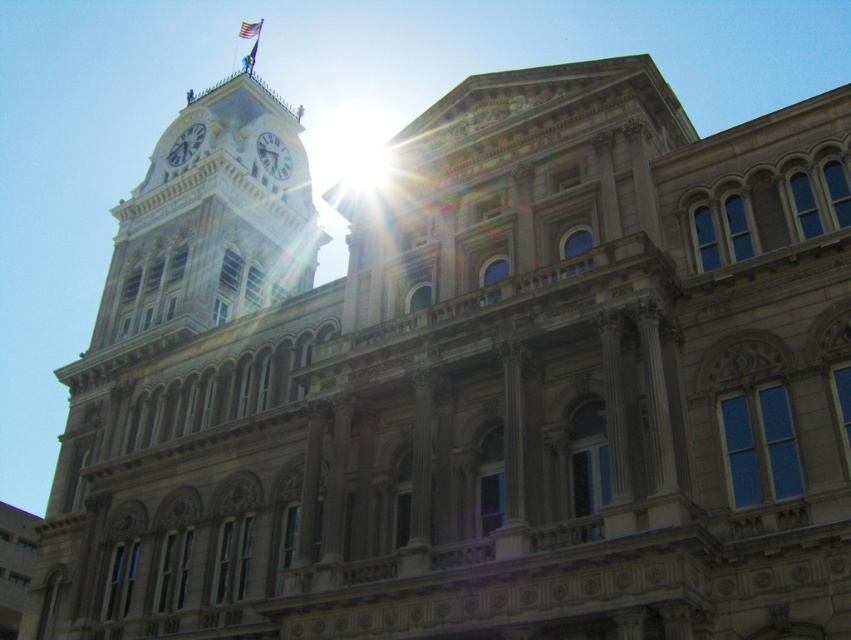
You are an architect reviewing the building design. You notice the white glossy clock at upper left and the american flag at upper center. Which object appears smaller in the image?

The white glossy clock at upper left appears smaller than the american flag at upper center.

You are an architect designing a new building and want to ensure the white marble clock at upper center and the american flag at upper center are proportionally balanced. Given their positions, which object should be adjusted to achieve better symmetry?

The white marble clock at upper center has a lesser width compared to the american flag at upper center. To achieve better symmetry, the white marble clock at upper center should be widened to match the width of the american flag at upper center.

You are standing in front of the historic building and notice a specific point marked at coordinates (273, 156). Based on the scene description, where exactly is this point located?

The point is located on the white marble clock at upper center.